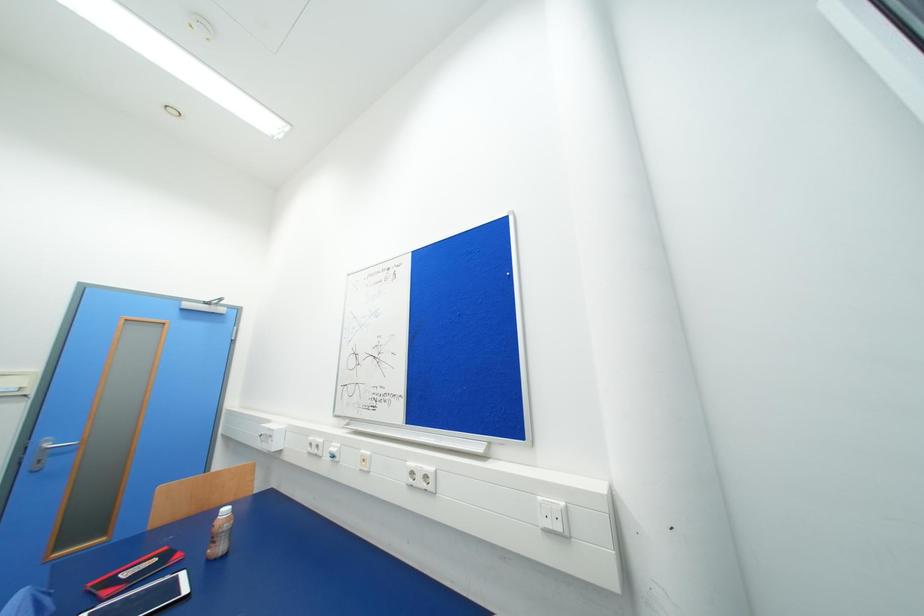
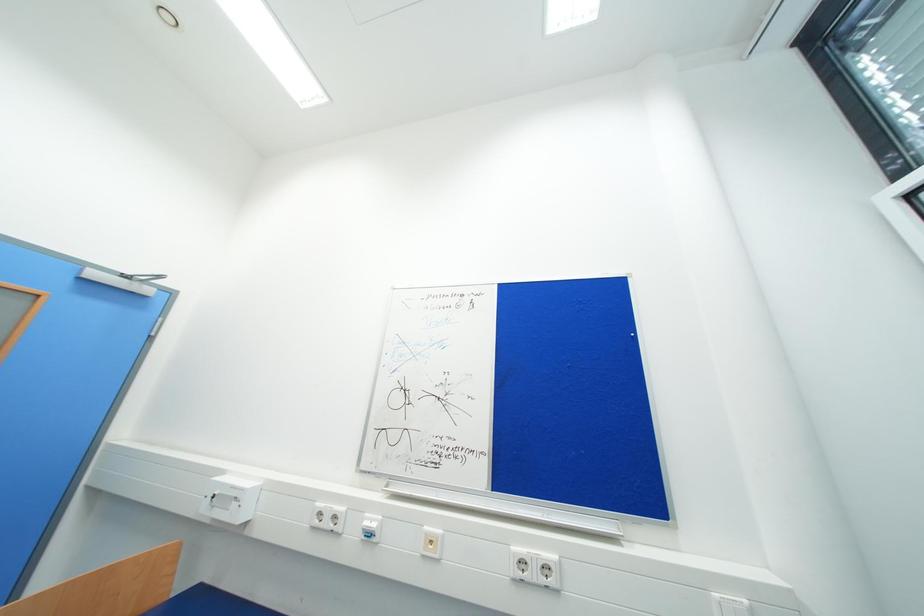
Question: The camera is either moving clockwise (left) or counter-clockwise (right) around the object. The first image is from the beginning of the video and the second image is from the end. Is the camera moving left or right when shooting the video?

Choices:
 (A) Left
 (B) Right

Answer: (A)